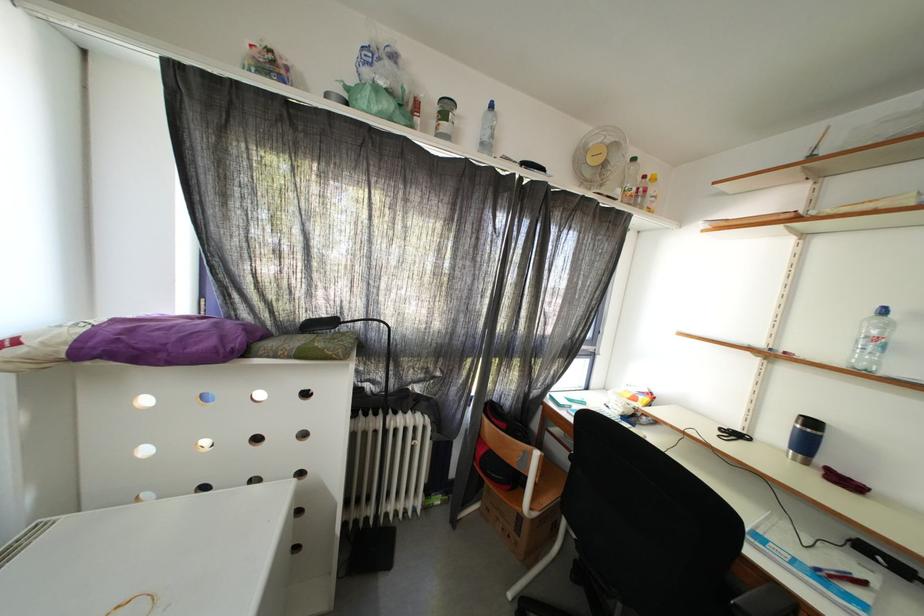
Where would you sit the chair sitting surface? Please return your answer as a coordinate pair (x, y).

(535, 485)